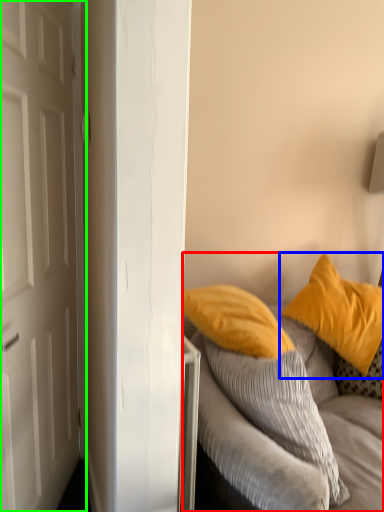
Question: Which object is positioned farthest from studio couch (highlighted by a red box)? Select from pillow (highlighted by a blue box) and door (highlighted by a green box).

Choices:
 (A) pillow
 (B) door

Answer: (B)